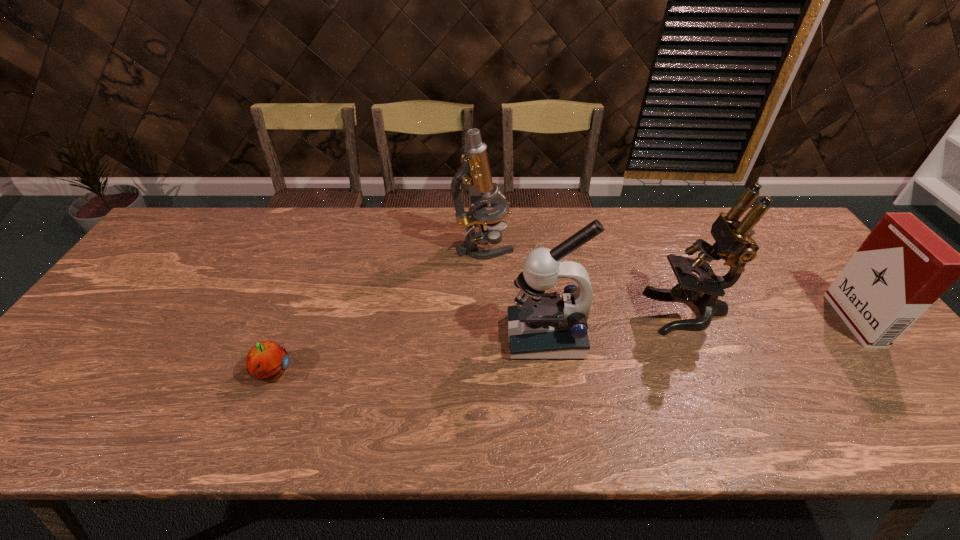
The height and width of the screenshot is (540, 960). In the image, there is a desktop. Identify the location of vacant space at the near right corner. (915, 418).

Where is `vacant area between the farthest microscope and the leftmost object`? This screenshot has height=540, width=960. vacant area between the farthest microscope and the leftmost object is located at coordinates (378, 310).

Where is `vacant space that is in between the shortest object and the second object from right to left`? The image size is (960, 540). vacant space that is in between the shortest object and the second object from right to left is located at coordinates pos(480,342).

The height and width of the screenshot is (540, 960). Identify the location of free point between the second object from right to left and the apple. (480, 342).

Identify which object is located as the second nearest to the fourth object from left to right. Please provide its 2D coordinates. Your answer should be formatted as a tuple, i.e. [(x, y)], where the tuple contains the x and y coordinates of a point satisfying the conditions above.

[(903, 267)]

Select which object is the fourth closest to the rightmost object. Please provide its 2D coordinates. Your answer should be formatted as a tuple, i.e. [(x, y)], where the tuple contains the x and y coordinates of a point satisfying the conditions above.

[(267, 361)]

Identify which microscope is located as the nearest to the fourth object from left to right. Please provide its 2D coordinates. Your answer should be formatted as a tuple, i.e. [(x, y)], where the tuple contains the x and y coordinates of a point satisfying the conditions above.

[(542, 325)]

Point out which microscope is positioned as the nearest to the farthest object. Please provide its 2D coordinates. Your answer should be formatted as a tuple, i.e. [(x, y)], where the tuple contains the x and y coordinates of a point satisfying the conditions above.

[(542, 325)]

Locate an element on the screen. This screenshot has width=960, height=540. free point that satisfies the following two spatial constraints: 1. on the back side of the apple; 2. on the right side of the farthest object is located at coordinates (323, 247).